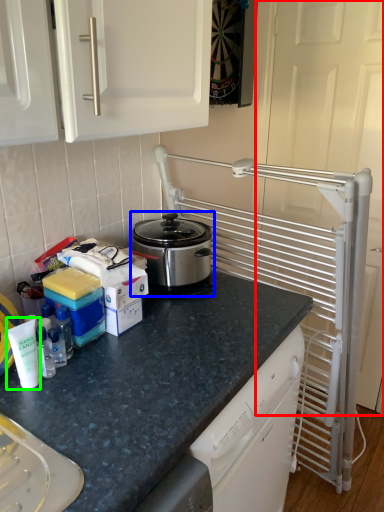
Question: Which object is the farthest from screen door (highlighted by a red box)? Choose among these: kitchen appliance (highlighted by a blue box) or bottle (highlighted by a green box).

Choices:
 (A) kitchen appliance
 (B) bottle

Answer: (B)